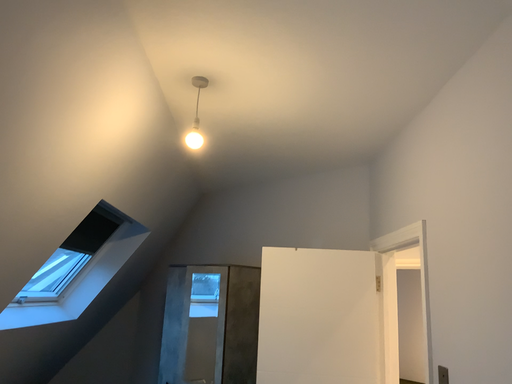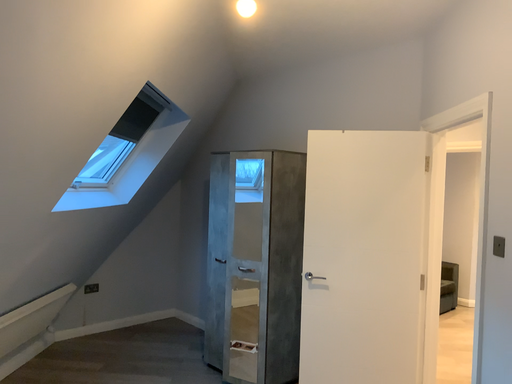
Question: Which way did the camera rotate in the video?

Choices:
 (A) rotated downward
 (B) rotated upward

Answer: (A)